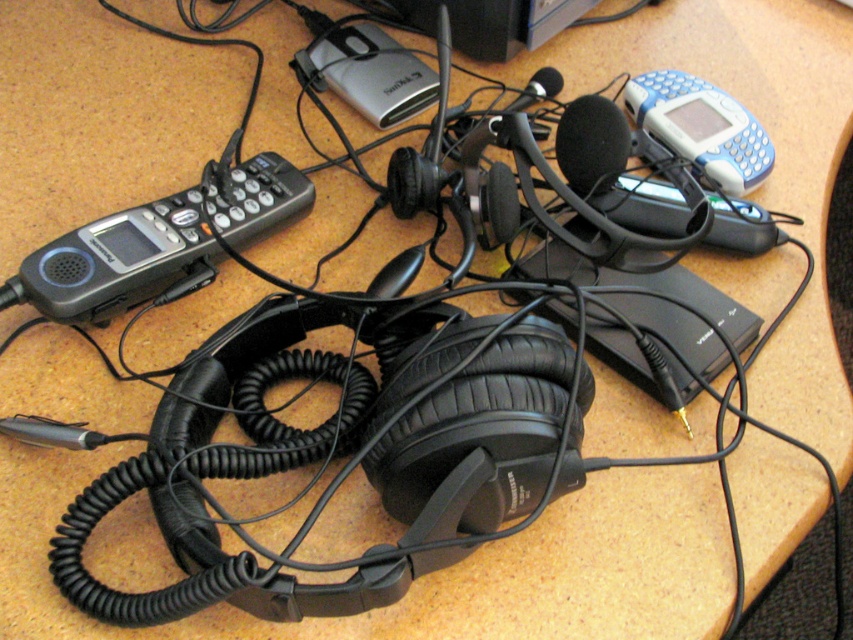
Question: Does black plastic phone at left have a greater width compared to black foam microphone at upper center?

Choices:
 (A) yes
 (B) no

Answer: (A)

Question: Which object appears closest to the camera in this image?

Choices:
 (A) black foam microphone at upper center
 (B) blue plastic phone at upper right

Answer: (A)

Question: Can you confirm if blue plastic phone at upper right is positioned to the left of black foam microphone at upper center?

Choices:
 (A) no
 (B) yes

Answer: (A)

Question: Is black plastic phone at left to the right of blue plastic phone at upper right from the viewer's perspective?

Choices:
 (A) yes
 (B) no

Answer: (B)

Question: Estimate the real-world distances between objects in this image. Which object is farther from the black foam microphone at upper center?

Choices:
 (A) blue plastic phone at upper right
 (B) black plastic phone at left

Answer: (B)

Question: Estimate the real-world distances between objects in this image. Which object is closer to the black plastic phone at left?

Choices:
 (A) blue plastic phone at upper right
 (B) black foam microphone at upper center

Answer: (B)